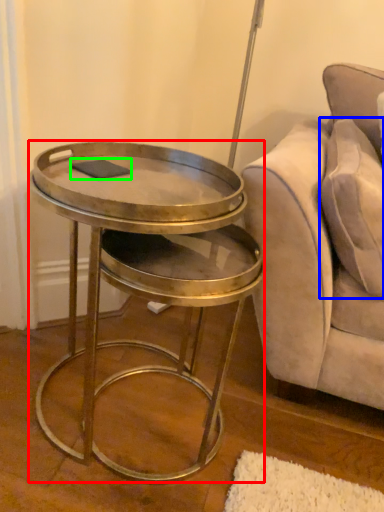
Question: Which is nearer to the table (highlighted by a red box)? pillow (highlighted by a blue box) or pad (highlighted by a green box).

Choices:
 (A) pillow
 (B) pad

Answer: (B)